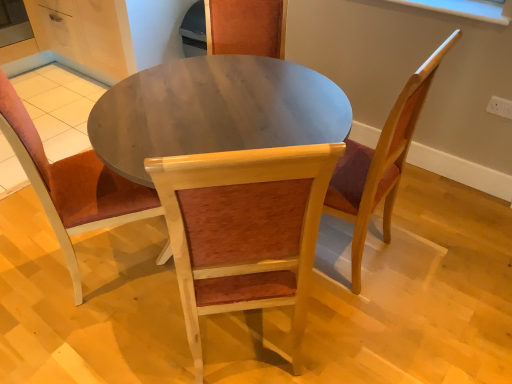
Question: Is wooden chair at center, marked as the first chair in a left-to-right arrangement, in front of or behind wooden chair at center, which appears as the 2th chair when viewed from the left, in the image?

Choices:
 (A) front
 (B) behind

Answer: (B)

Question: From the image's perspective, relative to wooden chair at center, the 2th chair in the right-to-left sequence, is wooden chair at center, marked as the first chair in a left-to-right arrangement, above or below?

Choices:
 (A) above
 (B) below

Answer: (A)

Question: Which is farther from the wooden chair at center, which appears as the 2th chair when viewed from the left?

Choices:
 (A) wooden chair with cushion at center, acting as the third chair starting from the left
 (B) wooden chair at center, marked as the first chair in a left-to-right arrangement

Answer: (B)

Question: Which object is positioned farthest from the wooden chair at center, the 2th chair in the right-to-left sequence?

Choices:
 (A) wooden chair at center, the third chair in the right-to-left sequence
 (B) wooden chair with cushion at center, acting as the third chair starting from the left

Answer: (A)